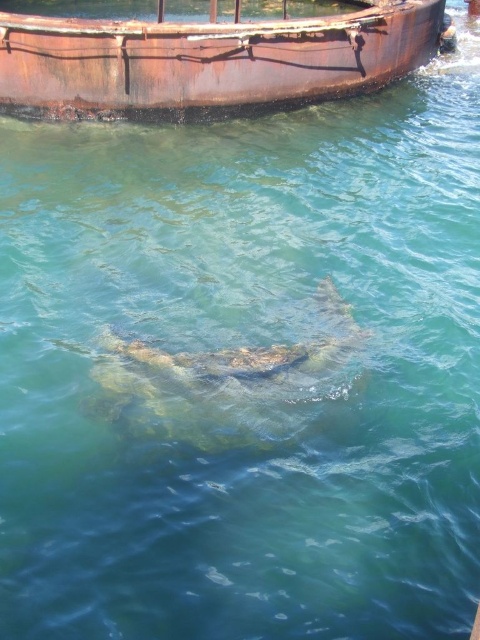
Can you confirm if rusty metal boat at upper center is taller than translucent greenish-brown fish at center?

Yes.

Which is below, rusty metal boat at upper center or translucent greenish-brown fish at center?

translucent greenish-brown fish at center is below.

Is point (213, 45) more distant than point (225, 358)?

Yes, it is.

You are a GUI agent. You are given a task and a screenshot of the screen. Output one action in this format:
    pyautogui.click(x=<x>, y=<y>)
    Task: Click on the rusty metal boat at upper center
    Image resolution: width=480 pixels, height=640 pixels.
    Given the screenshot: What is the action you would take?
    pyautogui.click(x=208, y=60)